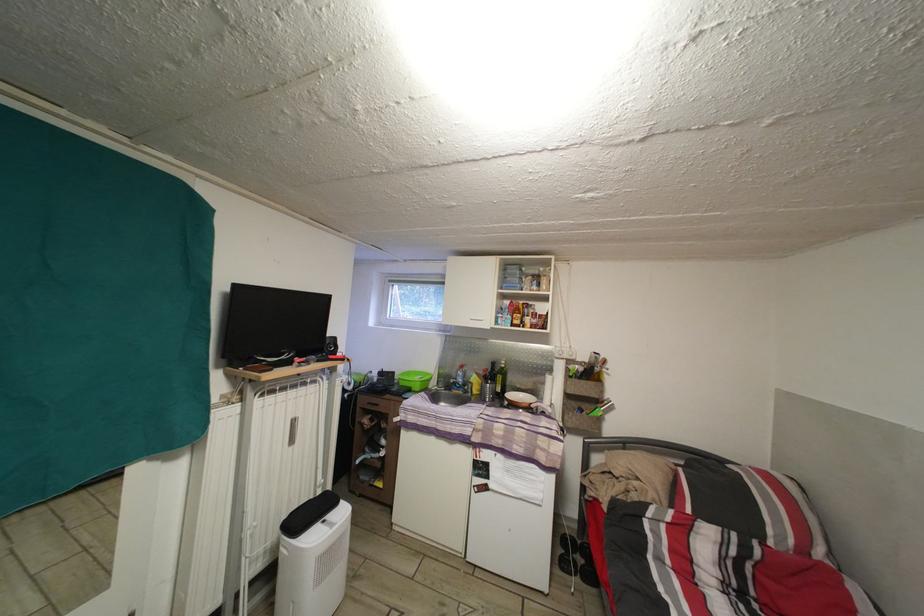
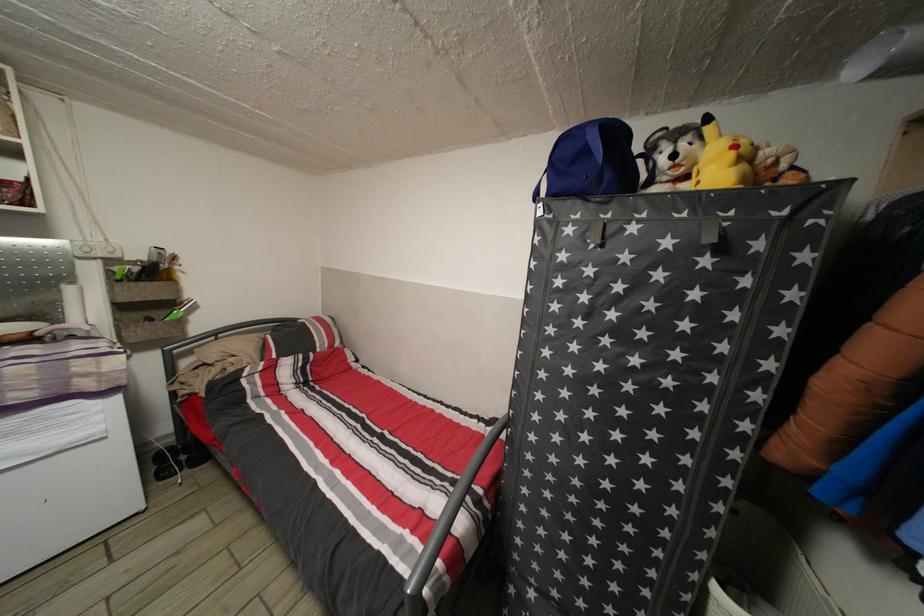
Locate, in the second image, the point that corresponds to (575,402) in the first image.

(128, 314)